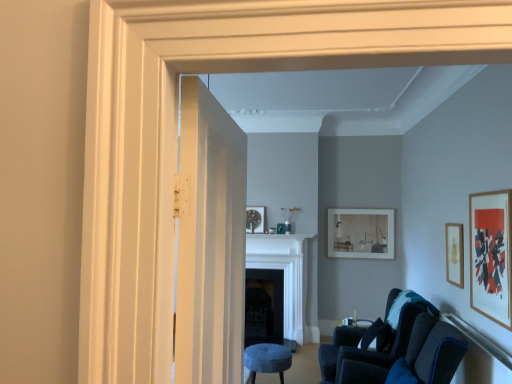
The image size is (512, 384). What do you see at coordinates (490, 255) in the screenshot? I see `matte white picture frame at right, arranged as the 3th picture frame when viewed from the back` at bounding box center [490, 255].

Describe the element at coordinates (264, 306) in the screenshot. I see `black matte fireplace at center, which ranks as the 1th fireplace in back-to-front order` at that location.

Describe the element at coordinates (370, 341) in the screenshot. I see `velvet dark blue chair at lower right` at that location.

Identify the location of wooden picture frame at right, the 2th picture frame when ordered from front to back. (454, 254).

At what (x,y) coordinates should I click in order to perform the action: click on picture frame that is the 3rd one above the velvet dark blue chair at lower right (from a real-world perspective). Please return your answer as a coordinate pair (x, y). Image resolution: width=512 pixels, height=384 pixels. Looking at the image, I should click on (490, 255).

Between velvet dark blue chair at lower right and matte white picture frame at right, arranged as the 3th picture frame when viewed from the back, which one has larger size?

Bigger between the two is velvet dark blue chair at lower right.

Could you tell me if velvet dark blue chair at lower right is facing matte white picture frame at right, placed as the 1th picture frame when sorted from front to back?

No, velvet dark blue chair at lower right is not turned towards matte white picture frame at right, placed as the 1th picture frame when sorted from front to back.

From a real-world perspective, which is physically above, velvet dark blue chair at lower right or matte white picture frame at right, arranged as the 3th picture frame when viewed from the back?

From a 3D spatial view, matte white picture frame at right, arranged as the 3th picture frame when viewed from the back, is above.

Which is more to the right, black matte fireplace at center, which ranks as the 1th fireplace in back-to-front order, or wooden picture frame at right, the 2th picture frame when ordered from front to back?

wooden picture frame at right, the 2th picture frame when ordered from front to back, is more to the right.

Looking at this image, from a real-world perspective, which object stands above the other?

In real-world perspective, wooden picture frame at right, the 2th picture frame when ordered from front to back, is above.

Considering the sizes of objects black matte fireplace at center, which ranks as the 1th fireplace in back-to-front order, and wooden picture frame at right, the 2th picture frame when ordered from front to back, in the image provided, who is shorter, black matte fireplace at center, which ranks as the 1th fireplace in back-to-front order, or wooden picture frame at right, the 2th picture frame when ordered from front to back,?

wooden picture frame at right, the 2th picture frame when ordered from front to back, is shorter.

Can you confirm if black matte fireplace at center, which ranks as the 1th fireplace in back-to-front order, is bigger than wooden picture frame at right, the 2th picture frame when ordered from front to back?

Indeed, black matte fireplace at center, which ranks as the 1th fireplace in back-to-front order, has a larger size compared to wooden picture frame at right, the 2th picture frame when ordered from front to back.

Between white marble fireplace at center, positioned as the 1th fireplace in front-to-back order, and velvet blue stool at lower center, which one is positioned behind?

white marble fireplace at center, positioned as the 1th fireplace in front-to-back order, is more distant.

In the scene shown: How different are the orientations of white marble fireplace at center, positioned as the 1th fireplace in front-to-back order, and velvet blue stool at lower center in degrees?

The angle between the facing direction of white marble fireplace at center, positioned as the 1th fireplace in front-to-back order, and the facing direction of velvet blue stool at lower center is 90.9 degrees.

From a real-world perspective, starting from the velvet blue stool at lower center, which fireplace is the 2nd one vertically above it? Please provide its 2D coordinates.

[(288, 280)]

Is white marble fireplace at center, positioned as the 1th fireplace in front-to-back order, completely or partially inside velvet dark blue chair at lower right?

No, white marble fireplace at center, positioned as the 1th fireplace in front-to-back order, is not surrounded by velvet dark blue chair at lower right.

From the image's perspective, would you say velvet dark blue chair at lower right is shown under white marble fireplace at center, which is the second fireplace from back to front?

Yes, from the image's perspective, velvet dark blue chair at lower right is beneath white marble fireplace at center, which is the second fireplace from back to front.

Is point (379, 363) less distant than point (251, 244)?

Yes, it is.

Does velvet dark blue chair at lower right have a lesser height compared to white marble fireplace at center, positioned as the 1th fireplace in front-to-back order?

Yes.

From the image's perspective, is matte white picture frame at center-right, which appears as the 3th picture frame when viewed from the front, located above or below matte white picture frame at right, placed as the 1th picture frame when sorted from front to back?

Based on their image positions, matte white picture frame at center-right, which appears as the 3th picture frame when viewed from the front, is located beneath matte white picture frame at right, placed as the 1th picture frame when sorted from front to back.

Considering the sizes of objects matte white picture frame at center-right, marked as the first picture frame in a back-to-front arrangement, and matte white picture frame at right, arranged as the 3th picture frame when viewed from the back, in the image provided, who is taller, matte white picture frame at center-right, marked as the first picture frame in a back-to-front arrangement, or matte white picture frame at right, arranged as the 3th picture frame when viewed from the back,?

With more height is matte white picture frame at right, arranged as the 3th picture frame when viewed from the back.

Considering the relative positions of matte white picture frame at center-right, marked as the first picture frame in a back-to-front arrangement, and matte white picture frame at right, placed as the 1th picture frame when sorted from front to back, in the image provided, is matte white picture frame at center-right, marked as the first picture frame in a back-to-front arrangement, to the left or to the right of matte white picture frame at right, placed as the 1th picture frame when sorted from front to back,?

From the image, it's evident that matte white picture frame at center-right, marked as the first picture frame in a back-to-front arrangement, is to the left of matte white picture frame at right, placed as the 1th picture frame when sorted from front to back.

Are matte white picture frame at center-right, marked as the first picture frame in a back-to-front arrangement, and matte white picture frame at right, placed as the 1th picture frame when sorted from front to back, making contact?

They are not placed beside each other.

Which is behind, black matte fireplace at center, placed as the second fireplace when sorted from front to back, or matte white picture frame at right, placed as the 1th picture frame when sorted from front to back?

Positioned behind is black matte fireplace at center, placed as the second fireplace when sorted from front to back.

Which is less distant, (271, 291) or (477, 252)?

The point (477, 252) is more forward.

From a real-world perspective, is black matte fireplace at center, which ranks as the 1th fireplace in back-to-front order, under matte white picture frame at right, placed as the 1th picture frame when sorted from front to back?

Yes, from a real-world perspective, black matte fireplace at center, which ranks as the 1th fireplace in back-to-front order, is beneath matte white picture frame at right, placed as the 1th picture frame when sorted from front to back.

You are a GUI agent. You are given a task and a screenshot of the screen. Output one action in this format:
    pyautogui.click(x=<x>, y=<y>)
    Task: Click on the 2nd fireplace below the matte white picture frame at right, arranged as the 3th picture frame when viewed from the back (from the image's perspective)
    
    Given the screenshot: What is the action you would take?
    pyautogui.click(x=264, y=306)

From a real-world perspective, which picture frame is the 2nd one above the white marble fireplace at center, which is the second fireplace from back to front? Please provide its 2D coordinates.

[(361, 233)]

Could you tell me if white marble fireplace at center, which is the second fireplace from back to front, is turned towards matte white picture frame at center-right, marked as the first picture frame in a back-to-front arrangement?

No, white marble fireplace at center, which is the second fireplace from back to front, does not turn towards matte white picture frame at center-right, marked as the first picture frame in a back-to-front arrangement.

Can we say white marble fireplace at center, which is the second fireplace from back to front, lies outside matte white picture frame at center-right, marked as the first picture frame in a back-to-front arrangement?

Yes, white marble fireplace at center, which is the second fireplace from back to front, is outside of matte white picture frame at center-right, marked as the first picture frame in a back-to-front arrangement.

Between white marble fireplace at center, positioned as the 1th fireplace in front-to-back order, and matte white picture frame at center-right, which appears as the 3th picture frame when viewed from the front, which one has smaller width?

matte white picture frame at center-right, which appears as the 3th picture frame when viewed from the front.

From the velvet dark blue chair at lower right, count 2nd picture frame to the right and point to it. Please provide its 2D coordinates.

[(490, 255)]

Locate an element on the screen. the 1st picture frame positioned above the black matte fireplace at center, placed as the second fireplace when sorted from front to back (from a real-world perspective) is located at coordinates (454, 254).

Based on their spatial positions, is matte white picture frame at center-right, marked as the first picture frame in a back-to-front arrangement, or velvet dark blue chair at lower right further from velvet blue stool at lower center?

Among the two, matte white picture frame at center-right, marked as the first picture frame in a back-to-front arrangement, is located further to velvet blue stool at lower center.

Looking at the image, which one is located further to matte white picture frame at center-right, marked as the first picture frame in a back-to-front arrangement, wooden picture frame at right, the 2th picture frame when ordered from front to back, or black matte fireplace at center, placed as the second fireplace when sorted from front to back?

Based on the image, wooden picture frame at right, the 2th picture frame when ordered from front to back, appears to be further to matte white picture frame at center-right, marked as the first picture frame in a back-to-front arrangement.

Looking at the image, which one is located further to white wooden door at center, matte white picture frame at center-right, which appears as the 3th picture frame when viewed from the front, or black matte fireplace at center, which ranks as the 1th fireplace in back-to-front order?

Based on the image, matte white picture frame at center-right, which appears as the 3th picture frame when viewed from the front, appears to be further to white wooden door at center.

When comparing their distances from black matte fireplace at center, which ranks as the 1th fireplace in back-to-front order, does matte white picture frame at right, placed as the 1th picture frame when sorted from front to back, or white marble fireplace at center, positioned as the 1th fireplace in front-to-back order, seem closer?

white marble fireplace at center, positioned as the 1th fireplace in front-to-back order, is positioned closer to the anchor black matte fireplace at center, which ranks as the 1th fireplace in back-to-front order.

Based on their spatial positions, is black matte fireplace at center, placed as the second fireplace when sorted from front to back, or velvet dark blue chair at lower right closer to matte white picture frame at right, arranged as the 3th picture frame when viewed from the back?

velvet dark blue chair at lower right is positioned closer to the anchor matte white picture frame at right, arranged as the 3th picture frame when viewed from the back.

Looking at the image, which one is located further to wooden picture frame at right, the 2th picture frame when ordered from front to back, velvet blue stool at lower center or black matte fireplace at center, which ranks as the 1th fireplace in back-to-front order?

Among the two, black matte fireplace at center, which ranks as the 1th fireplace in back-to-front order, is located further to wooden picture frame at right, the 2th picture frame when ordered from front to back.

Considering their positions, is white wooden door at center positioned closer to matte white picture frame at right, arranged as the 3th picture frame when viewed from the back, than matte white picture frame at center-right, which appears as the 3th picture frame when viewed from the front?

white wooden door at center lies closer to matte white picture frame at right, arranged as the 3th picture frame when viewed from the back, than the other object.

When comparing their distances from velvet dark blue chair at lower right, does wooden picture frame at right, the 2th picture frame when ordered from front to back, or velvet blue stool at lower center seem further?

wooden picture frame at right, the 2th picture frame when ordered from front to back, is positioned further to the anchor velvet dark blue chair at lower right.

Locate an element on the screen. The width and height of the screenshot is (512, 384). picture frame located between velvet dark blue chair at lower right and white marble fireplace at center, which is the second fireplace from back to front, in the depth direction is located at coordinates (454, 254).

You are a GUI agent. You are given a task and a screenshot of the screen. Output one action in this format:
    pyautogui.click(x=<x>, y=<y>)
    Task: Click on the picture frame located between matte white picture frame at right, arranged as the 3th picture frame when viewed from the back, and matte white picture frame at center-right, marked as the first picture frame in a back-to-front arrangement, in the depth direction
    This screenshot has width=512, height=384.
    Given the screenshot: What is the action you would take?
    pyautogui.click(x=454, y=254)

I want to click on furniture between velvet dark blue chair at lower right and black matte fireplace at center, placed as the second fireplace when sorted from front to back, in the front-back direction, so click(x=267, y=360).

Find the location of a particular element. The width and height of the screenshot is (512, 384). picture frame positioned between velvet dark blue chair at lower right and black matte fireplace at center, placed as the second fireplace when sorted from front to back, from near to far is located at coordinates (454, 254).